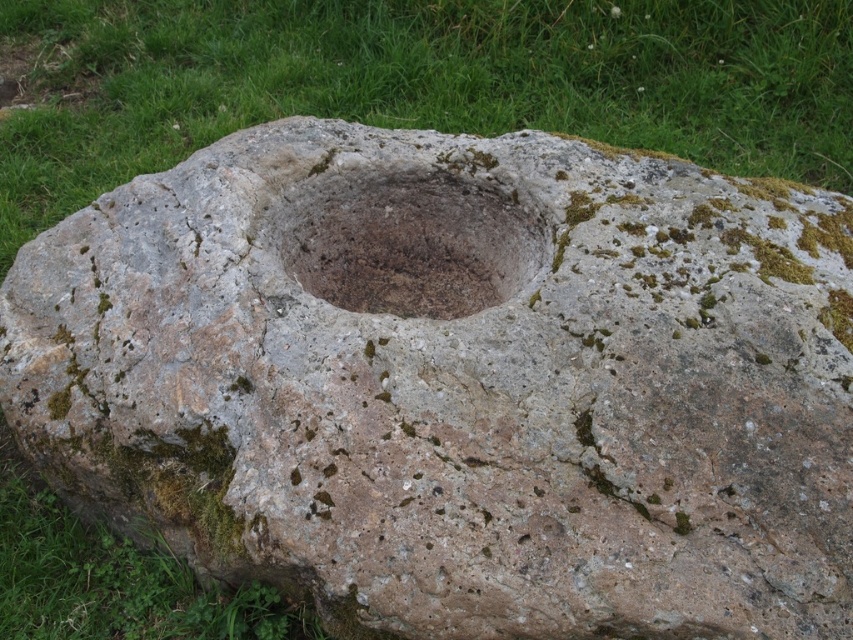
Describe the element at coordinates (422, 81) in the screenshot. I see `green grass at upper center` at that location.

From the picture: Does green grass at upper center appear on the left side of brown stone hole at center?

Yes, green grass at upper center is to the left of brown stone hole at center.

Describe the element at coordinates (422, 81) in the screenshot. I see `green grass at upper center` at that location.

Where is `green grass at upper center`? This screenshot has width=853, height=640. green grass at upper center is located at coordinates (422, 81).